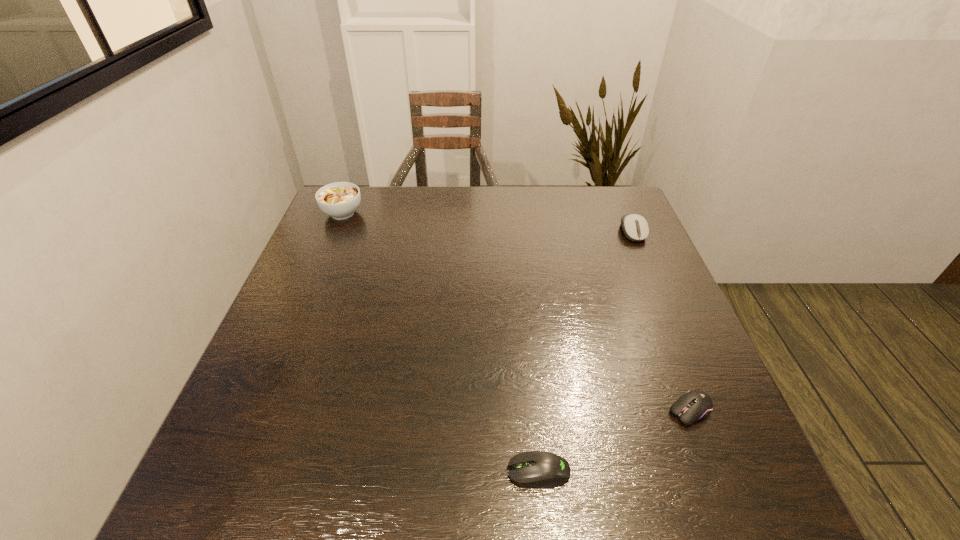
Image resolution: width=960 pixels, height=540 pixels. In order to click on vacant area situated 0.360m on the wheel side of the second object from left to right in this screenshot , I will do `click(300, 471)`.

The image size is (960, 540). I want to click on blank space located 0.280m on the wheel side of the second object from left to right, so click(x=346, y=471).

The height and width of the screenshot is (540, 960). What are the coordinates of `vacant space located on the wheel side of the second object from left to right` in the screenshot? It's located at (397, 471).

Locate an element on the screen. The image size is (960, 540). soup bowl present at the far edge is located at coordinates (340, 200).

The width and height of the screenshot is (960, 540). What are the coordinates of `computer equipment that is positioned at the far edge` in the screenshot? It's located at (635, 227).

The width and height of the screenshot is (960, 540). I want to click on object located at the near edge, so click(x=539, y=469).

Where is `object located at the left edge`? Image resolution: width=960 pixels, height=540 pixels. object located at the left edge is located at coordinates (340, 200).

This screenshot has width=960, height=540. I want to click on object positioned at the far left corner, so click(340, 200).

At what (x,y) coordinates should I click in order to perform the action: click on object located in the far right corner section of the desktop. Please return your answer as a coordinate pair (x, y). Looking at the image, I should click on (635, 227).

Identify the location of vacant area at the far edge. (561, 205).